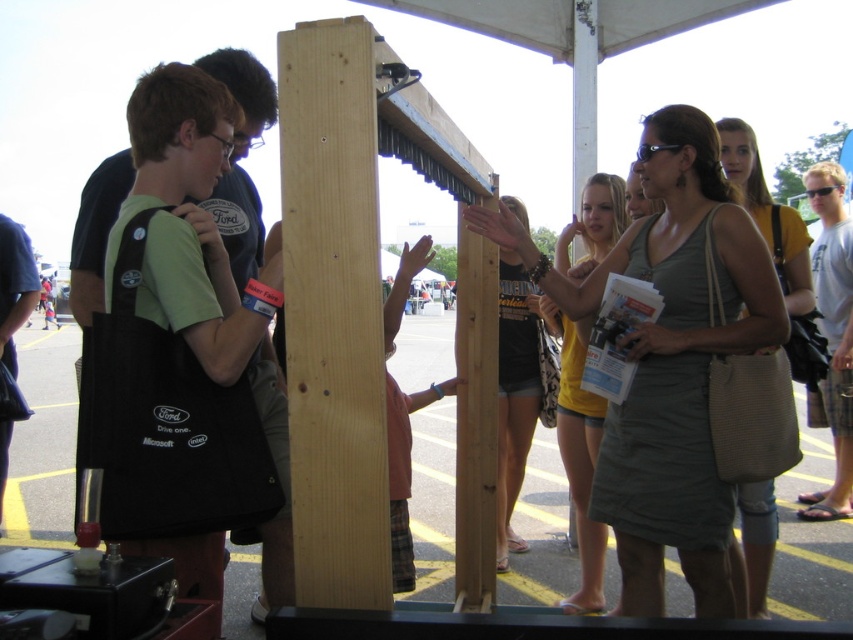
Question: Among these objects, which one is farthest from the camera?

Choices:
 (A) black cotton shirt at center
 (B) black plastic goggles at upper center
 (C) beige woven bag at center

Answer: (A)

Question: Is yellow cotton tank top at right to the left of light blue t-shirt at center from the viewer's perspective?

Choices:
 (A) yes
 (B) no

Answer: (A)

Question: Which object is closer to the camera taking this photo?

Choices:
 (A) dark blue shirt at left
 (B) black plastic goggles at upper right
 (C) yellow cotton tank top at right
 (D) beige woven bag at center

Answer: (C)

Question: Among these objects, which one is farthest from the camera?

Choices:
 (A) black fabric bag at left
 (B) beige woven bag at center
 (C) black plastic goggles at upper center
 (D) black plastic goggles at upper right

Answer: (D)

Question: Is beige woven bag at center above black plastic goggles at upper right?

Choices:
 (A) no
 (B) yes

Answer: (A)

Question: Observing the image, what is the correct spatial positioning of black fabric bag at left in reference to yellow cotton tank top at right?

Choices:
 (A) left
 (B) right

Answer: (A)